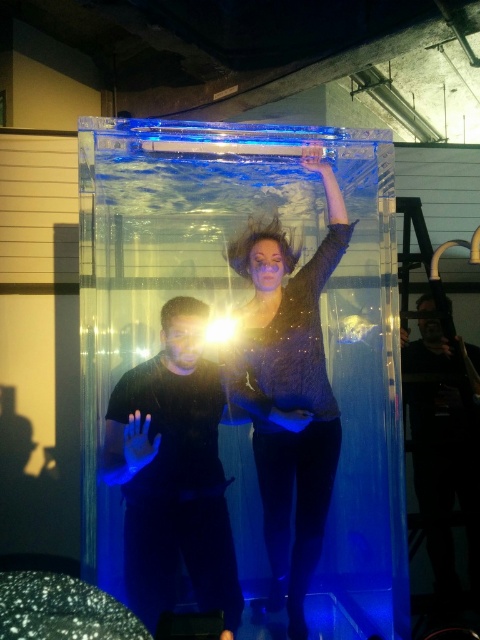
From the picture: Can you confirm if transparent acrylic tank at center is positioned below matte black dress at center?

Actually, transparent acrylic tank at center is above matte black dress at center.

Is transparent acrylic tank at center further to camera compared to matte black dress at center?

No, it is in front of matte black dress at center.

Between point (387, 564) and point (326, 412), which one is positioned in front?

Point (387, 564)

At what (x,y) coordinates should I click in order to perform the action: click on transparent acrylic tank at center. Please return your answer as a coordinate pair (x, y). This screenshot has height=640, width=480. Looking at the image, I should click on (242, 369).

Consider the image. Who is positioned more to the right, matte black shirt at center or dark matte man at center?

dark matte man at center is more to the right.

The width and height of the screenshot is (480, 640). Describe the element at coordinates (173, 472) in the screenshot. I see `matte black shirt at center` at that location.

This screenshot has height=640, width=480. I want to click on matte black shirt at center, so click(x=173, y=472).

Identify the location of matte black shirt at center. (173, 472).

Can you confirm if matte black dress at center is positioned to the left of dark matte man at center?

Correct, you'll find matte black dress at center to the left of dark matte man at center.

Between matte black dress at center and dark matte man at center, which one has more height?

matte black dress at center is taller.

Describe the element at coordinates (288, 390) in the screenshot. I see `matte black dress at center` at that location.

Locate an element on the screen. The width and height of the screenshot is (480, 640). matte black dress at center is located at coordinates (288, 390).